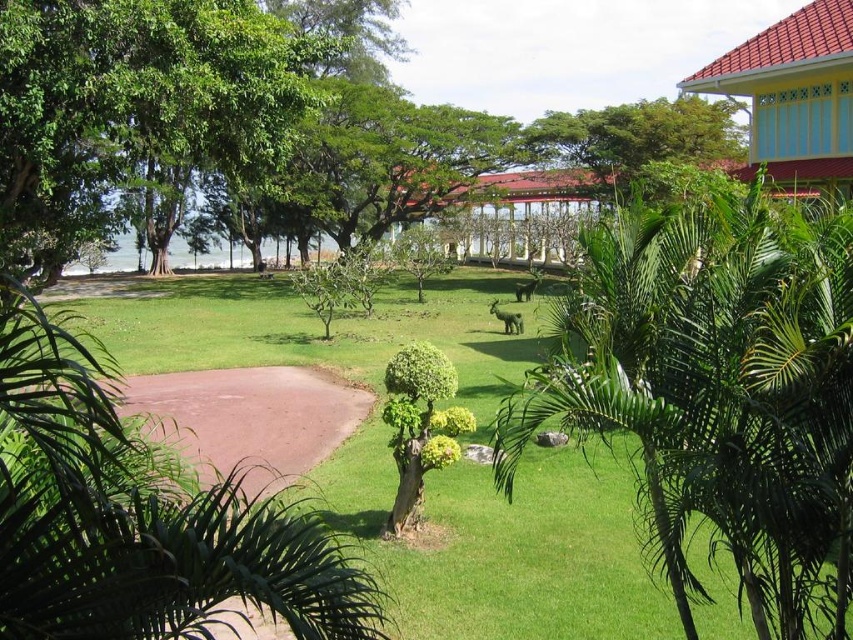
Does green leafy palm tree at center-right appear under green leafy palm tree at lower left?

Indeed, green leafy palm tree at center-right is positioned under green leafy palm tree at lower left.

Who is lower down, green leafy palm tree at center-right or green leafy palm tree at lower left?

Positioned lower is green leafy palm tree at center-right.

Is point (697, 420) positioned before point (128, 490)?

No, it is behind (128, 490).

What are the coordinates of `green leafy palm tree at center-right` in the screenshot? It's located at (720, 394).

What do you see at coordinates (140, 516) in the screenshot? The image size is (853, 640). I see `green leafy palm tree at lower left` at bounding box center [140, 516].

Which is in front, point (33, 600) or point (849, 144)?

Positioned in front is point (33, 600).

The height and width of the screenshot is (640, 853). What do you see at coordinates (140, 516) in the screenshot? I see `green leafy palm tree at lower left` at bounding box center [140, 516].

Locate an element on the screen. The height and width of the screenshot is (640, 853). green leafy palm tree at lower left is located at coordinates (140, 516).

Between green leafy palm tree at center-right and yellow painted wood hut at upper right, which one appears on the left side from the viewer's perspective?

green leafy palm tree at center-right

Which is below, green leafy palm tree at center-right or yellow painted wood hut at upper right?

green leafy palm tree at center-right is below.

This screenshot has width=853, height=640. Describe the element at coordinates (720, 394) in the screenshot. I see `green leafy palm tree at center-right` at that location.

The image size is (853, 640). I want to click on green leafy palm tree at center-right, so click(720, 394).